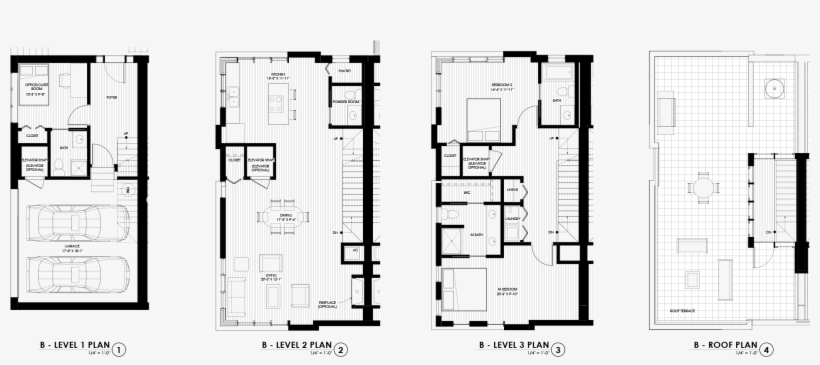
The image size is (820, 365). I want to click on illustrations of beds, so click(35, 82), click(485, 113), click(467, 291).